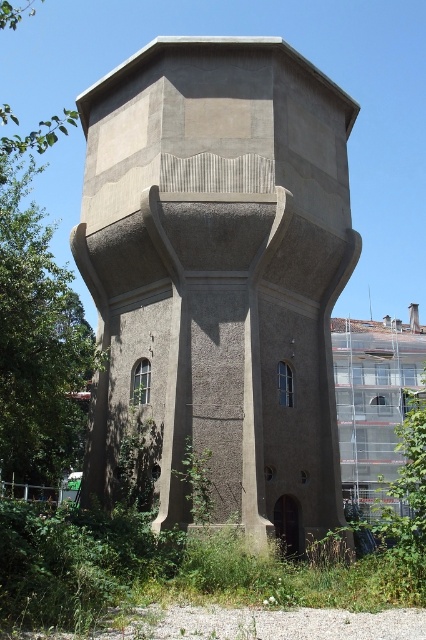
Question: Can you confirm if concrete textured tower at center is positioned to the left of green leafy weed at lower center?

Choices:
 (A) yes
 (B) no

Answer: (B)

Question: Is concrete textured tower at center behind green leafy weed at lower center?

Choices:
 (A) no
 (B) yes

Answer: (A)

Question: Among these points, which one is nearest to the camera?

Choices:
 (A) (181, 481)
 (B) (181, 253)

Answer: (A)

Question: Where is concrete textured tower at center located in relation to green leafy weed at lower center in the image?

Choices:
 (A) left
 (B) right

Answer: (B)

Question: Which of the following is the farthest from the observer?

Choices:
 (A) green leafy weed at lower center
 (B) concrete textured tower at center

Answer: (A)

Question: Which object appears farthest from the camera in this image?

Choices:
 (A) concrete textured tower at center
 (B) green leafy weed at lower center

Answer: (B)